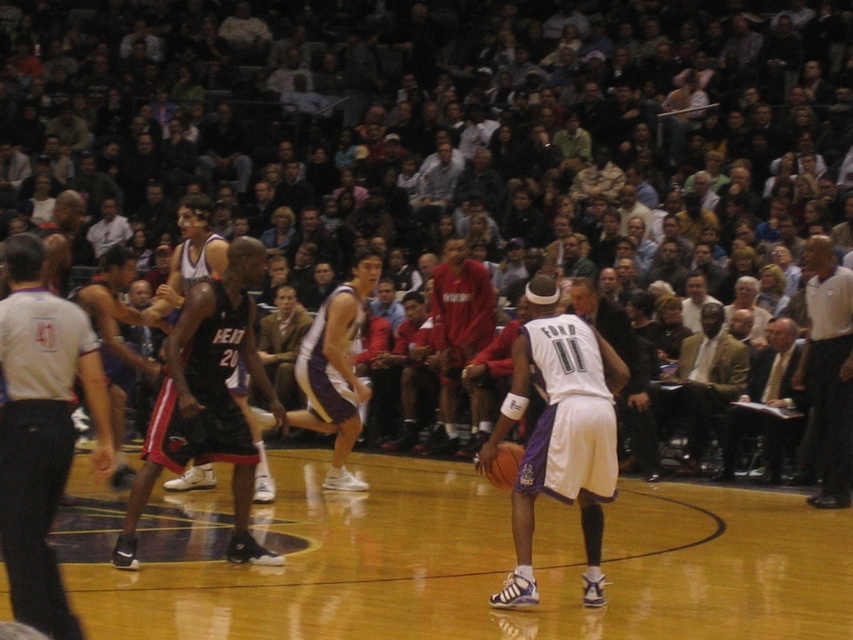
The height and width of the screenshot is (640, 853). Identify the location of glossy wood basketball court at center. (471, 563).

Between glossy wood basketball court at center and white shirt at left, which one is positioned higher?

white shirt at left is above.

Which is behind, point (770, 620) or point (10, 552)?

The point (770, 620) is more distant.

The image size is (853, 640). I want to click on glossy wood basketball court at center, so click(471, 563).

The image size is (853, 640). What do you see at coordinates (448, 134) in the screenshot? I see `dark clothing crowd at center` at bounding box center [448, 134].

Who is shorter, dark clothing crowd at center or light brown suit jacket at right?

Standing shorter between the two is light brown suit jacket at right.

I want to click on dark clothing crowd at center, so click(448, 134).

Looking at this image, which is more to the right, red jersey at center or shiny orange basketball at center?

Positioned to the right is shiny orange basketball at center.

Between point (485, 333) and point (514, 444), which one is positioned in front?

Point (514, 444)

Which is behind, point (453, 316) or point (521, 452)?

The point (453, 316) is behind.

I want to click on red jersey at center, so click(x=457, y=326).